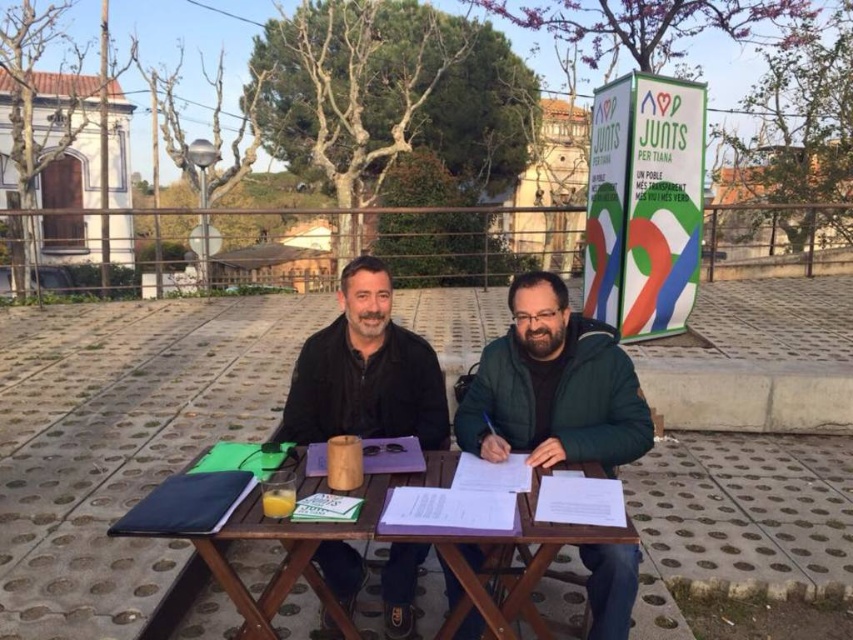
Question: Which of the following is the farthest from the observer?

Choices:
 (A) (196, 536)
 (B) (560, 353)

Answer: (B)

Question: Which point is farther from the camera taking this photo?

Choices:
 (A) (322, 376)
 (B) (480, 406)
 (C) (236, 524)

Answer: (A)

Question: Is green matte jacket at center further to the viewer compared to black matte jacket at center?

Choices:
 (A) yes
 (B) no

Answer: (B)

Question: Where is green matte jacket at center located in relation to black matte jacket at center in the image?

Choices:
 (A) below
 (B) above

Answer: (A)

Question: Among these objects, which one is nearest to the camera?

Choices:
 (A) green matte jacket at center
 (B) wooden picnic table at center
 (C) black matte jacket at center

Answer: (B)

Question: Can you confirm if wooden picnic table at center is smaller than black matte jacket at center?

Choices:
 (A) no
 (B) yes

Answer: (A)